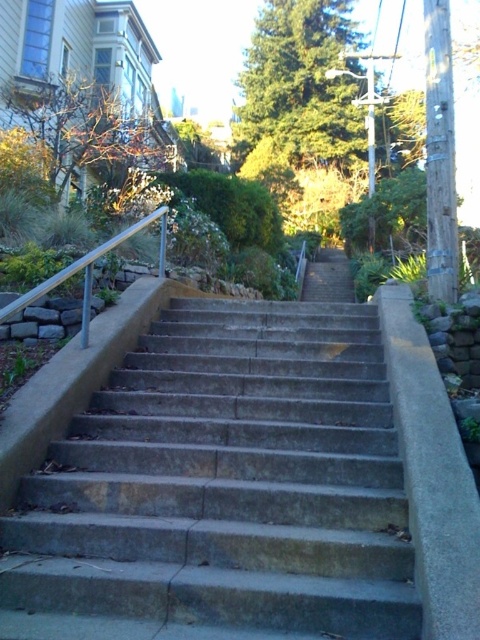
Is concrete stairs at center to the right of satin silver railing at left from the viewer's perspective?

Correct, you'll find concrete stairs at center to the right of satin silver railing at left.

The image size is (480, 640). What do you see at coordinates (222, 490) in the screenshot? I see `concrete stairs at center` at bounding box center [222, 490].

You are a GUI agent. You are given a task and a screenshot of the screen. Output one action in this format:
    pyautogui.click(x=<x>, y=<y>)
    Task: Click on the concrete stairs at center
    The width and height of the screenshot is (480, 640).
    Given the screenshot: What is the action you would take?
    pyautogui.click(x=222, y=490)